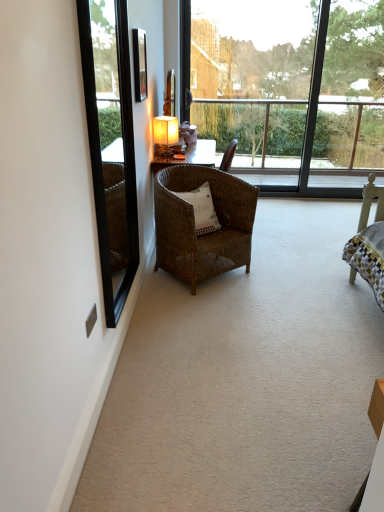
Question: Looking at the image, does woven brown chair at center seem bigger or smaller compared to matte yellow lampshade at center?

Choices:
 (A) small
 (B) big

Answer: (B)

Question: Is woven brown chair at center wider or thinner than matte yellow lampshade at center?

Choices:
 (A) thin
 (B) wide

Answer: (B)

Question: Which object is positioned closest to the white woven pillow at center?

Choices:
 (A) woven brown chair at center
 (B) matte black picture frame at upper center
 (C) matte yellow lampshade at center
 (D) transparent glass window at upper center
 (E) metallic silver power outlet at lower left

Answer: (A)

Question: Based on their relative distances, which object is nearer to the matte black picture frame at upper center?

Choices:
 (A) black glass mirror at left
 (B) transparent glass window at upper center
 (C) white woven pillow at center
 (D) metallic silver power outlet at lower left
 (E) matte yellow lampshade at center

Answer: (E)